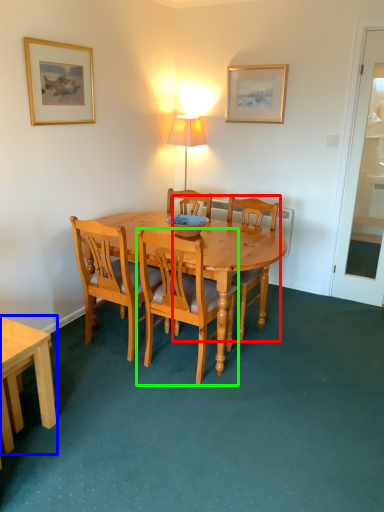
Question: Which object is the farthest from chair (highlighted by a red box)? Choose among these: desk (highlighted by a blue box) or chair (highlighted by a green box).

Choices:
 (A) desk
 (B) chair

Answer: (A)